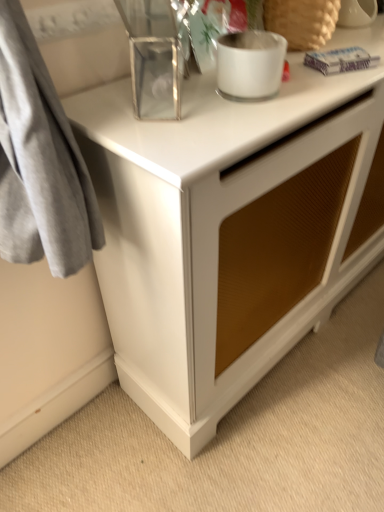
Where is `free space to the left of frosted glass candle at upper center, which ranks as the second appliance in right-to-left order`? free space to the left of frosted glass candle at upper center, which ranks as the second appliance in right-to-left order is located at coordinates (155, 102).